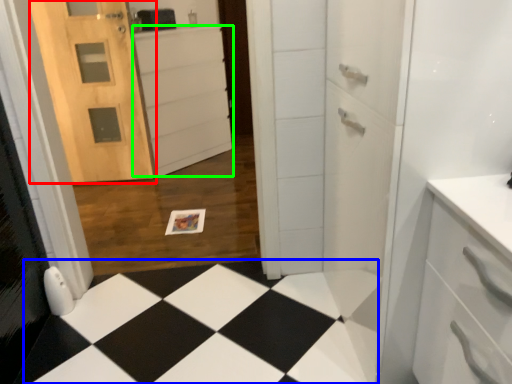
Question: Considering the real-world distances, which object is closest to door (highlighted by a red box)? square (highlighted by a blue box) or cabinetry (highlighted by a green box).

Choices:
 (A) square
 (B) cabinetry

Answer: (B)